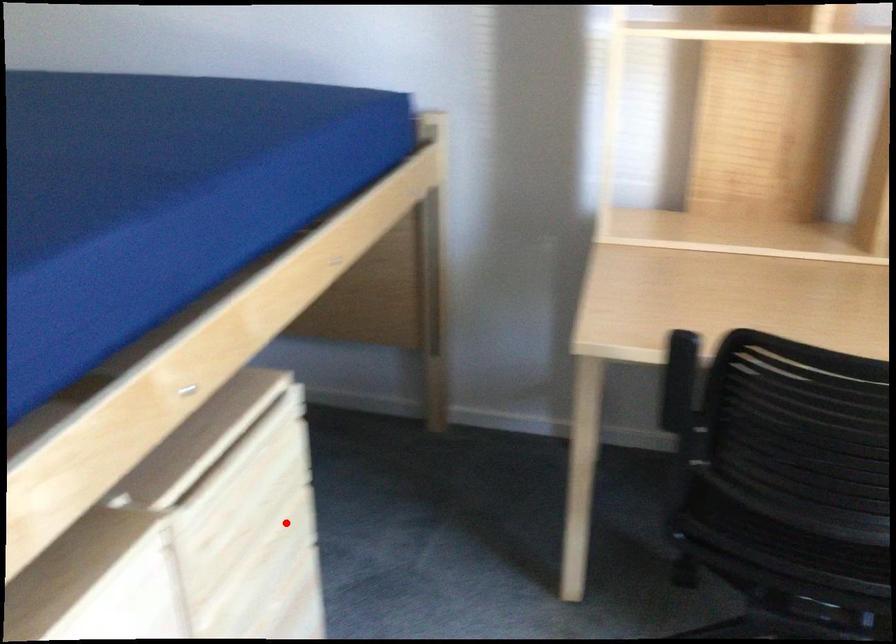
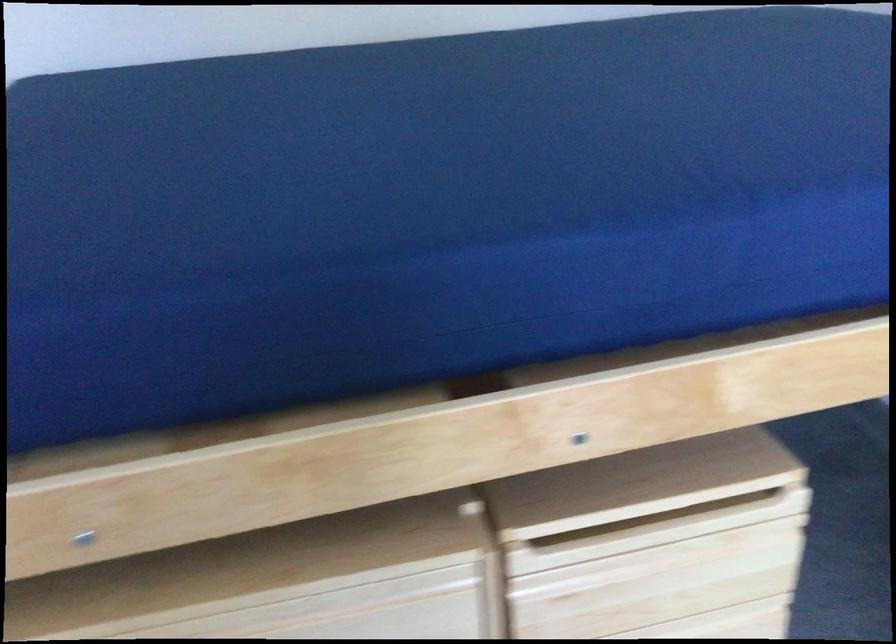
Find the pixel in the second image that matches the highlighted location in the first image.

(725, 623)